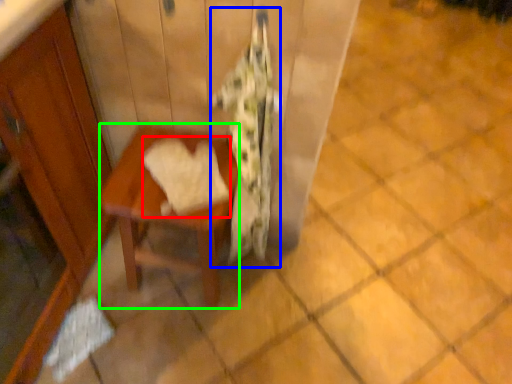
Question: Based on their relative distances, which object is farther from bath towel (highlighted by a red box)? Choose from blanket (highlighted by a blue box) and table (highlighted by a green box).

Choices:
 (A) blanket
 (B) table

Answer: (A)